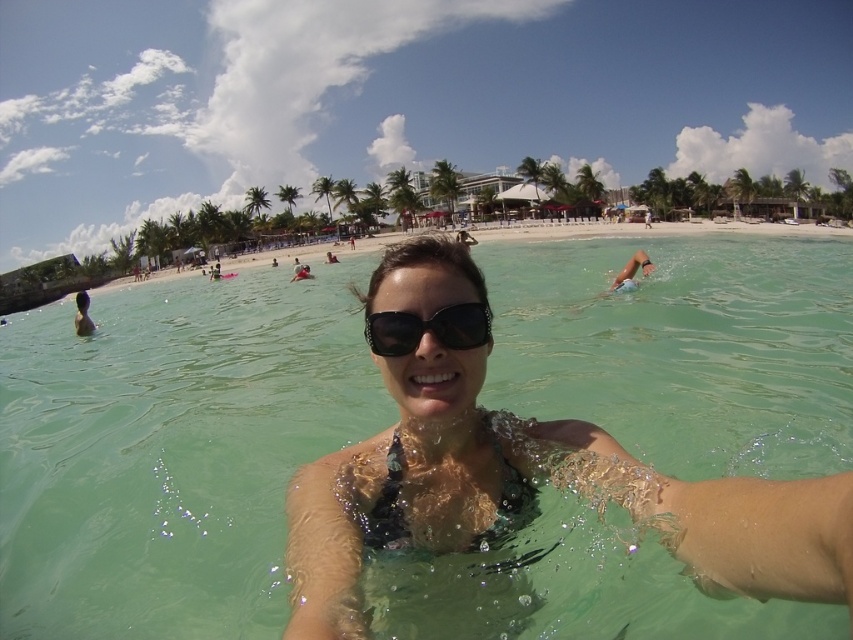
You are a swimmer who wants to put on your black rubber goggles at center before entering the clear water at center. Can you reach the goggles without getting into the water?

The clear water at center is positioned over black rubber goggles at center, which means the goggles are underwater. You cannot reach them without getting into the water.

You are a swimmer who wants to see the underwater world clearly while wearing your black rubber goggles at center. However, there is clear water at center in front of your goggles. Will the water interfere with your view?

The clear water at center is in front of the black rubber goggles at center, so it will not interfere with your view since the water is clear and allows visibility.

You are a photographer trying to capture the clear water at center and the black rubber goggles at center in a single shot. Which object should you focus on first if you want to ensure both are in frame without moving the camera?

The clear water at center is larger in size than the black rubber goggles at center, so you should focus on the clear water at center first to ensure it fits within the frame before adjusting for the smaller goggles.